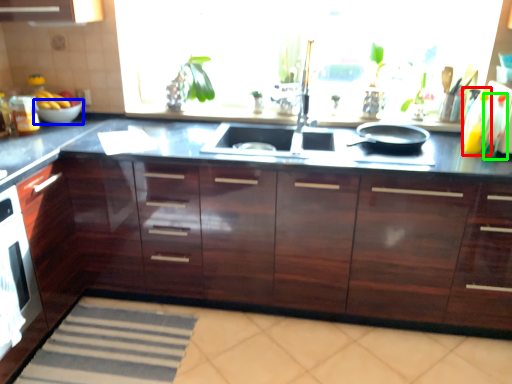
Question: Estimate the real-world distances between objects in this image. Which object is farther from bottle (highlighted by a red box), bowl (highlighted by a blue box) or bottle (highlighted by a green box)?

Choices:
 (A) bowl
 (B) bottle

Answer: (A)